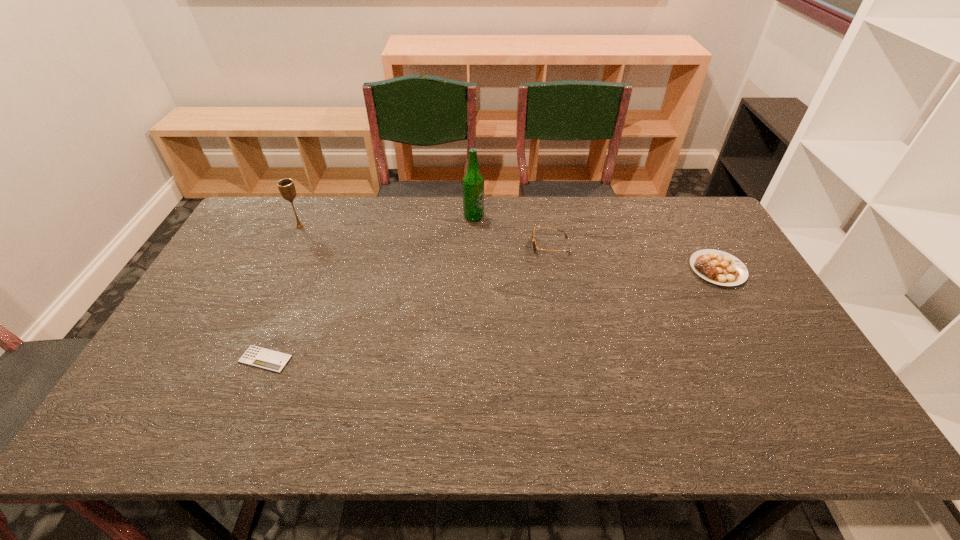
Find the location of a particular element. unoccupied position between the nearest object and the rightmost object is located at coordinates (492, 314).

You are a GUI agent. You are given a task and a screenshot of the screen. Output one action in this format:
    pyautogui.click(x=<x>, y=<y>)
    Task: Click on the free space between the shortest object and the rightmost object
    The image size is (960, 540).
    Given the screenshot: What is the action you would take?
    pyautogui.click(x=492, y=314)

This screenshot has height=540, width=960. Identify the location of free space between the fourth shortest object and the calculator. (282, 293).

What are the coordinates of `vacant area that lies between the second tallest object and the fourth object from left to right` in the screenshot? It's located at (425, 237).

This screenshot has width=960, height=540. Find the location of `free spot between the rightmost object and the tallest object`. free spot between the rightmost object and the tallest object is located at coordinates (595, 243).

Find the location of `object identified as the closest to the second tallest object`. object identified as the closest to the second tallest object is located at coordinates (263, 358).

Select which object is the second closest to the beer bottle. Please provide its 2D coordinates. Your answer should be formatted as a tuple, i.e. [(x, y)], where the tuple contains the x and y coordinates of a point satisfying the conditions above.

[(286, 186)]

Locate an element on the screen. The height and width of the screenshot is (540, 960). free location that satisfies the following two spatial constraints: 1. on the front-facing side of the rightmost object; 2. on the left side of the sunglasses is located at coordinates (555, 269).

Identify the location of free space in the image that satisfies the following two spatial constraints: 1. on the label of the third object from left to right; 2. on the front side of the fourth shortest object. (473, 226).